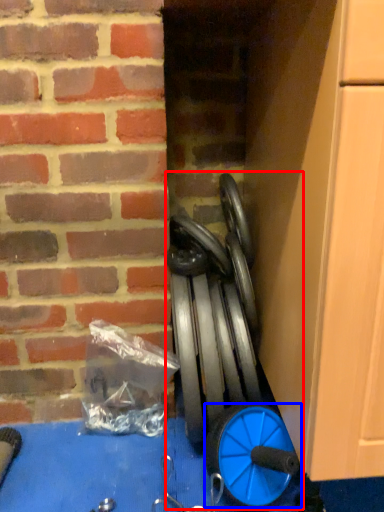
Question: Which object appears closest to the camera in this image, sport equipment (highlighted by a red box) or wheel (highlighted by a blue box)?

Choices:
 (A) sport equipment
 (B) wheel

Answer: (B)